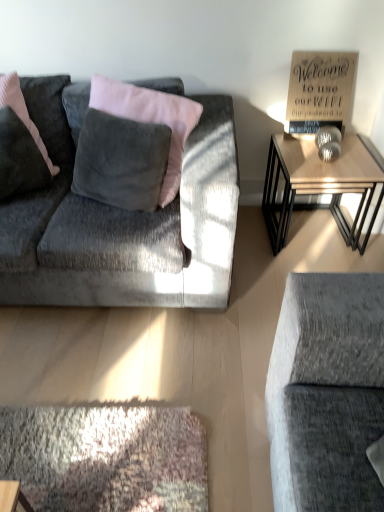
Identify the location of velvet gray couch at left. (128, 232).

Measure the distance between point (154, 219) and camera.

They are 5.47 feet apart.

Locate an element on the screen. Image resolution: width=384 pixels, height=512 pixels. wooden sign at upper right is located at coordinates (319, 91).

This screenshot has height=512, width=384. I want to click on velvet gray couch at left, so click(128, 232).

From the image's perspective, is wooden sign at upper right located beneath velvet dark gray pillow at left?

No, from the image's perspective, wooden sign at upper right is not beneath velvet dark gray pillow at left.

Considering the relative sizes of wooden sign at upper right and velvet dark gray pillow at left in the image provided, is wooden sign at upper right smaller than velvet dark gray pillow at left?

Yes.

Does point (318, 55) lie in front of point (15, 103)?

No.

Is wooden sign at upper right outside of velvet dark gray pillow at left?

Absolutely, wooden sign at upper right is external to velvet dark gray pillow at left.

Visually, is velvet dark gray pillow at left positioned to the left or to the right of wooden sign at upper right?

velvet dark gray pillow at left is positioned on wooden sign at upper right's left side.

Is velvet dark gray pillow at left looking in the opposite direction of wooden sign at upper right?

That's not correct — velvet dark gray pillow at left is not looking away from wooden sign at upper right.

Who is taller, velvet dark gray pillow at left or wooden sign at upper right?

Standing taller between the two is velvet dark gray pillow at left.

Would you say wooden sign at upper right is a long distance from velvet gray couch at left?

No.

From the image's perspective, relative to velvet gray couch at left, is wooden sign at upper right above or below?

wooden sign at upper right is above velvet gray couch at left.

From the picture: Can we say wooden sign at upper right lies outside velvet gray couch at left?

Absolutely, wooden sign at upper right is external to velvet gray couch at left.

Is wooden sign at upper right oriented away from velvet gray couch at left?

No, velvet gray couch at left is not at the back of wooden sign at upper right.

Based on the photo, is velvet dark gray pillow at left in contact with wooden table at right?

There is a gap between velvet dark gray pillow at left and wooden table at right.

Is velvet dark gray pillow at left to the left of wooden table at right from the viewer's perspective?

Correct, you'll find velvet dark gray pillow at left to the left of wooden table at right.

At what (x,y) coordinates should I click in order to perform the action: click on table lying behind the velvet dark gray pillow at left. Please return your answer as a coordinate pair (x, y). The height and width of the screenshot is (512, 384). Looking at the image, I should click on (321, 184).

Consider the image. Does wooden table at right have a larger size compared to velvet dark gray pillow at left?

Yes.

From a real-world perspective, is wooden table at right over velvet dark gray pillow at left?

No.

Choose the correct answer: Is wooden table at right inside velvet dark gray pillow at left or outside it?

wooden table at right is not inside velvet dark gray pillow at left, it's outside.

Is wooden table at right far away from velvet dark gray pillow at left?

Yes, wooden table at right and velvet dark gray pillow at left are quite far apart.

Which object is closer to the camera taking this photo, wooden table at right or velvet gray couch at left?

velvet gray couch at left is more forward.

Is point (271, 165) less distant than point (195, 181)?

No, it is not.

From the image's perspective, who appears lower, wooden table at right or velvet gray couch at left?

From the image's view, wooden table at right is below.

Can you tell me how much wooden table at right and velvet gray couch at left differ in facing direction?

2.33 degrees separate the facing orientations of wooden table at right and velvet gray couch at left.

There is a wooden table at right. At what (x,y) coordinates should I click in order to perform the action: click on studio couch above it (from a real-world perspective). Please return your answer as a coordinate pair (x, y). Looking at the image, I should click on (128, 232).

From the image's perspective, which is above, velvet gray couch at left or wooden table at right?

velvet gray couch at left, from the image's perspective.

Does velvet gray couch at left have a lesser width compared to wooden table at right?

No, velvet gray couch at left is not thinner than wooden table at right.

Based on their positions, is velvet gray couch at left located to the left or right of wooden table at right?

From the image, it's evident that velvet gray couch at left is to the left of wooden table at right.

In order to click on bulletin board above the velvet dark gray pillow at left (from a real-world perspective) in this screenshot , I will do coord(319,91).

The image size is (384, 512). I want to click on bulletin board located on the right of velvet dark gray pillow at left, so click(319, 91).

From the image, which object appears to be nearer to velvet gray couch at left, wooden sign at upper right or velvet dark gray pillow at left?

velvet dark gray pillow at left is closer to velvet gray couch at left.

Looking at the image, which one is located further to wooden sign at upper right, velvet dark gray pillow at left or velvet gray couch at left?

velvet dark gray pillow at left.

In the scene shown: From the image, which object appears to be nearer to wooden sign at upper right, wooden table at right or velvet dark gray pillow at left?

wooden table at right is closer to wooden sign at upper right.

Looking at the image, which one is located further to wooden table at right, wooden sign at upper right or velvet gray couch at left?

Among the two, velvet gray couch at left is located further to wooden table at right.

Estimate the real-world distances between objects in this image. Which object is further from wooden table at right, wooden sign at upper right or velvet dark gray pillow at left?

velvet dark gray pillow at left is positioned further to the anchor wooden table at right.

Estimate the real-world distances between objects in this image. Which object is closer to wooden sign at upper right, wooden table at right or velvet gray couch at left?

wooden table at right.

Looking at the image, which one is located closer to wooden table at right, velvet dark gray pillow at left or wooden sign at upper right?

Based on the image, wooden sign at upper right appears to be nearer to wooden table at right.

Which object lies nearer to the anchor point wooden sign at upper right, velvet gray couch at left or velvet dark gray pillow at left?

velvet gray couch at left lies closer to wooden sign at upper right than the other object.

Image resolution: width=384 pixels, height=512 pixels. Find the location of `bulletin board situated between velvet dark gray pillow at left and wooden table at right from left to right`. bulletin board situated between velvet dark gray pillow at left and wooden table at right from left to right is located at coordinates (319, 91).

At what (x,y) coordinates should I click in order to perform the action: click on studio couch situated between velvet dark gray pillow at left and wooden sign at upper right from left to right. Please return your answer as a coordinate pair (x, y). Looking at the image, I should click on (128, 232).

Where is `studio couch between velvet dark gray pillow at left and wooden table at right from left to right`? The image size is (384, 512). studio couch between velvet dark gray pillow at left and wooden table at right from left to right is located at coordinates (128, 232).

This screenshot has height=512, width=384. I want to click on bulletin board situated between velvet gray couch at left and wooden table at right from left to right, so click(319, 91).